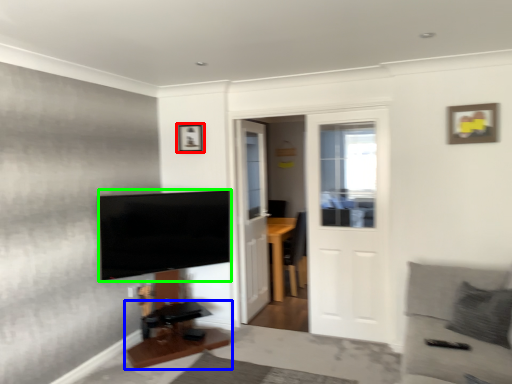
Question: Based on their relative distances, which object is farther from picture frame (highlighted by a red box)? Choose from table (highlighted by a blue box) and television (highlighted by a green box).

Choices:
 (A) table
 (B) television

Answer: (A)